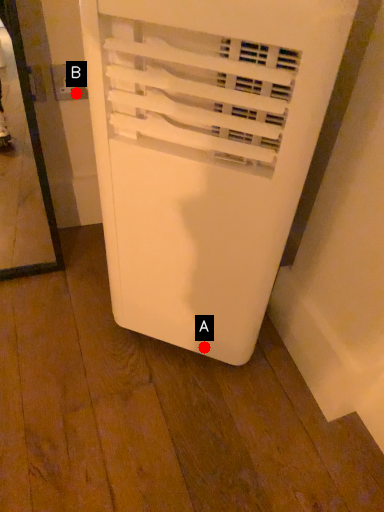
Question: Two points are circled on the image, labeled by A and B beside each circle. Which point is further to the camera?

Choices:
 (A) A is further
 (B) B is further

Answer: (B)